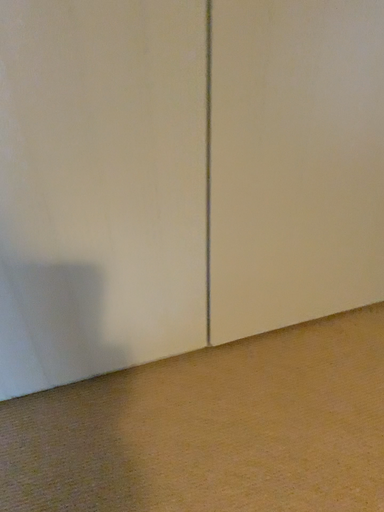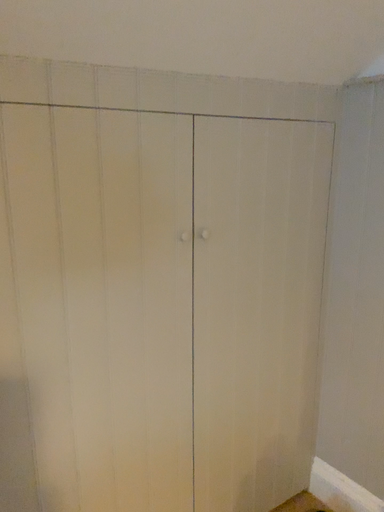
Question: Which way did the camera rotate in the video?

Choices:
 (A) rotated upward
 (B) rotated downward

Answer: (A)